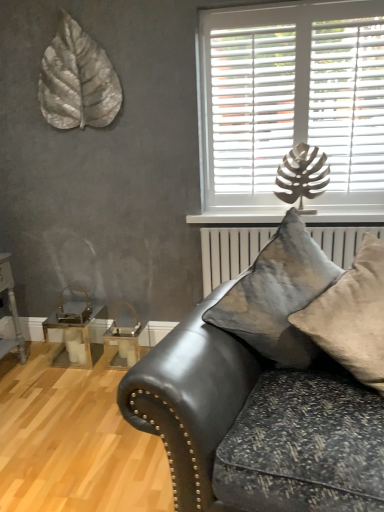
Based on the photo, what is the approximate width of metallic gold table at lower left, placed as the second table when sorted from right to left?

The width of metallic gold table at lower left, placed as the second table when sorted from right to left, is 11.11 inches.

Measure the distance between metallic silver leaf at upper left and camera.

2.38 meters.

Measure the distance between point (208, 380) and camera.

4.64 feet.

This screenshot has height=512, width=384. Describe the element at coordinates (291, 99) in the screenshot. I see `white plastic blinds at upper right` at that location.

You are a GUI agent. You are given a task and a screenshot of the screen. Output one action in this format:
    pyautogui.click(x=<x>, y=<y>)
    Task: Click on the white plastic blinds at upper right
    This screenshot has height=512, width=384.
    Given the screenshot: What is the action you would take?
    pyautogui.click(x=291, y=99)

Find the location of a particular element. This screenshot has height=512, width=384. velvet gray pillow at center, the first pillow positioned from the left is located at coordinates (277, 295).

What is the approximate height of textured beige pillow at center, which appears as the first pillow when viewed from the right?

textured beige pillow at center, which appears as the first pillow when viewed from the right, is 21.19 inches in height.

I want to click on textured beige pillow at center, the second pillow from the left, so click(x=352, y=316).

Where is `clear glass table at lower left, the second table in the left-to-right sequence`? clear glass table at lower left, the second table in the left-to-right sequence is located at coordinates (122, 347).

How different are the orientations of textured beige pillow at center, the second pillow from the left, and velvet gray pillow at center, which is the 2th pillow in right-to-left order, in degrees?

The angular difference between textured beige pillow at center, the second pillow from the left, and velvet gray pillow at center, which is the 2th pillow in right-to-left order, is 0.000203 degrees.

Is point (310, 315) positioned after point (238, 286)?

No, (310, 315) is closer to viewer.

Is textured beige pillow at center, which appears as the first pillow when viewed from the right, wider than velvet gray pillow at center, which is the 2th pillow in right-to-left order?

Indeed, textured beige pillow at center, which appears as the first pillow when viewed from the right, has a greater width compared to velvet gray pillow at center, which is the 2th pillow in right-to-left order.

Which is correct: textured beige pillow at center, which appears as the first pillow when viewed from the right, is inside velvet gray pillow at center, the first pillow positioned from the left, or outside of it?

textured beige pillow at center, which appears as the first pillow when viewed from the right, can be found inside velvet gray pillow at center, the first pillow positioned from the left.

From the image's perspective, would you say leather couch at lower right is shown under white plastic blinds at upper right?

Correct, leather couch at lower right appears lower than white plastic blinds at upper right in the image.

Considering the relative sizes of leather couch at lower right and white plastic blinds at upper right in the image provided, is leather couch at lower right wider than white plastic blinds at upper right?

Yes.

Can you confirm if leather couch at lower right is taller than white plastic blinds at upper right?

Incorrect, the height of leather couch at lower right is not larger of that of white plastic blinds at upper right.

The width and height of the screenshot is (384, 512). In order to click on the 1st table positioned below the velvet gray pillow at center, which is the 2th pillow in right-to-left order (from the image's perspective) in this screenshot , I will do `click(76, 328)`.

From their relative heights in the image, would you say metallic gold table at lower left, which is counted as the first table, starting from the left, is taller or shorter than velvet gray pillow at center, the first pillow positioned from the left?

metallic gold table at lower left, which is counted as the first table, starting from the left, is shorter than velvet gray pillow at center, the first pillow positioned from the left.

Considering the relative sizes of metallic gold table at lower left, placed as the second table when sorted from right to left, and velvet gray pillow at center, which is the 2th pillow in right-to-left order, in the image provided, is metallic gold table at lower left, placed as the second table when sorted from right to left, bigger than velvet gray pillow at center, which is the 2th pillow in right-to-left order,?

Actually, metallic gold table at lower left, placed as the second table when sorted from right to left, might be smaller than velvet gray pillow at center, which is the 2th pillow in right-to-left order.

Which of these two, metallic gold table at lower left, placed as the second table when sorted from right to left, or velvet gray pillow at center, the first pillow positioned from the left, is wider?

Wider between the two is velvet gray pillow at center, the first pillow positioned from the left.

Considering the relative positions of clear glass table at lower left, which appears as the first table when viewed from the right, and velvet gray pillow at center, the first pillow positioned from the left, in the image provided, is clear glass table at lower left, which appears as the first table when viewed from the right, to the left or to the right of velvet gray pillow at center, the first pillow positioned from the left,?

From the image, it's evident that clear glass table at lower left, which appears as the first table when viewed from the right, is to the left of velvet gray pillow at center, the first pillow positioned from the left.

Could you measure the distance between clear glass table at lower left, which appears as the first table when viewed from the right, and velvet gray pillow at center, the first pillow positioned from the left?

clear glass table at lower left, which appears as the first table when viewed from the right, and velvet gray pillow at center, the first pillow positioned from the left, are 1.36 meters apart from each other.

From the image's perspective, is clear glass table at lower left, the second table in the left-to-right sequence, beneath velvet gray pillow at center, which is the 2th pillow in right-to-left order?

Yes, from the image's perspective, clear glass table at lower left, the second table in the left-to-right sequence, is beneath velvet gray pillow at center, which is the 2th pillow in right-to-left order.

Which of these two, clear glass table at lower left, which appears as the first table when viewed from the right, or velvet gray pillow at center, which is the 2th pillow in right-to-left order, is bigger?

velvet gray pillow at center, which is the 2th pillow in right-to-left order, is bigger.

Would you consider textured beige pillow at center, the second pillow from the left, to be distant from metallic gold table at lower left, which is counted as the first table, starting from the left?

Yes, textured beige pillow at center, the second pillow from the left, and metallic gold table at lower left, which is counted as the first table, starting from the left, are located far from each other.

From the image's perspective, which one is positioned higher, textured beige pillow at center, which appears as the first pillow when viewed from the right, or metallic gold table at lower left, which is counted as the first table, starting from the left?

textured beige pillow at center, which appears as the first pillow when viewed from the right, is shown above in the image.

Which of these two, textured beige pillow at center, the second pillow from the left, or metallic gold table at lower left, placed as the second table when sorted from right to left, is thinner?

metallic gold table at lower left, placed as the second table when sorted from right to left.

Which point is more distant from viewer, (353, 335) or (60, 323)?

→ The point (60, 323) is farther.

Consider the image. Is the position of leather couch at lower right more distant than that of clear glass table at lower left, the second table in the left-to-right sequence?

That is False.

Is leather couch at lower right facing towards clear glass table at lower left, which appears as the first table when viewed from the right?

No, leather couch at lower right is not aimed at clear glass table at lower left, which appears as the first table when viewed from the right.

Where is `studio couch that is on the right side of clear glass table at lower left, the second table in the left-to-right sequence`? The height and width of the screenshot is (512, 384). studio couch that is on the right side of clear glass table at lower left, the second table in the left-to-right sequence is located at coordinates (191, 398).

Considering the sizes of objects leather couch at lower right and clear glass table at lower left, which appears as the first table when viewed from the right, in the image provided, who is wider, leather couch at lower right or clear glass table at lower left, which appears as the first table when viewed from the right,?

Result: leather couch at lower right.

From a real-world perspective, which object stands above the other?

In real-world perspective, metallic silver leaf at upper left is above.

Would you say metallic silver leaf at upper left is a long distance from textured beige pillow at center, which appears as the first pillow when viewed from the right?

metallic silver leaf at upper left is positioned a significant distance from textured beige pillow at center, which appears as the first pillow when viewed from the right.

Looking at this image, can you confirm if metallic silver leaf at upper left is wider than textured beige pillow at center, which appears as the first pillow when viewed from the right?

In fact, metallic silver leaf at upper left might be narrower than textured beige pillow at center, which appears as the first pillow when viewed from the right.

Considering the positions of points (52, 111) and (352, 286), is point (52, 111) farther from camera compared to point (352, 286)?

Yes, point (52, 111) is farther from viewer.

Where is `pillow on the left of the textured beige pillow at center, the second pillow from the left`? pillow on the left of the textured beige pillow at center, the second pillow from the left is located at coordinates (277, 295).

Locate an element on the screen. Image resolution: width=384 pixels, height=512 pixels. window that appears behind the leather couch at lower right is located at coordinates click(x=291, y=99).

Looking at the image, which one is located further to white plastic blinds at upper right, velvet gray pillow at center, the first pillow positioned from the left, or textured beige pillow at center, the second pillow from the left?

textured beige pillow at center, the second pillow from the left.

Estimate the real-world distances between objects in this image. Which object is closer to textured beige pillow at center, the second pillow from the left, white plastic blinds at upper right or metallic silver leaf at upper left?

white plastic blinds at upper right is closer to textured beige pillow at center, the second pillow from the left.

Which object lies further to the anchor point leather couch at lower right, metallic silver leaf at upper left or clear glass table at lower left, the second table in the left-to-right sequence?

metallic silver leaf at upper left is further to leather couch at lower right.

When comparing their distances from velvet gray pillow at center, which is the 2th pillow in right-to-left order, does metallic gold table at lower left, which is counted as the first table, starting from the left, or metallic silver leaf at upper left seem further?

Based on the image, metallic silver leaf at upper left appears to be further to velvet gray pillow at center, which is the 2th pillow in right-to-left order.

When comparing their distances from clear glass table at lower left, which appears as the first table when viewed from the right, does metallic silver leaf at upper left or leather couch at lower right seem closer?

The object closer to clear glass table at lower left, which appears as the first table when viewed from the right, is leather couch at lower right.

Based on their spatial positions, is metallic silver leaf at upper left or metallic gold table at lower left, which is counted as the first table, starting from the left, closer to white plastic blinds at upper right?

metallic silver leaf at upper left.

Which object lies further to the anchor point metallic silver leaf at upper left, velvet gray pillow at center, which is the 2th pillow in right-to-left order, or white plastic blinds at upper right?

velvet gray pillow at center, which is the 2th pillow in right-to-left order, is positioned further to the anchor metallic silver leaf at upper left.

Looking at the image, which one is located further to leather couch at lower right, metallic gold table at lower left, placed as the second table when sorted from right to left, or white plastic blinds at upper right?

Based on the image, metallic gold table at lower left, placed as the second table when sorted from right to left, appears to be further to leather couch at lower right.

At what (x,y) coordinates should I click in order to perform the action: click on table between white plastic blinds at upper right and clear glass table at lower left, the second table in the left-to-right sequence, vertically. Please return your answer as a coordinate pair (x, y). The width and height of the screenshot is (384, 512). Looking at the image, I should click on (76, 328).

Locate an element on the screen. The image size is (384, 512). pillow between velvet gray pillow at center, the first pillow positioned from the left, and leather couch at lower right, in the vertical direction is located at coordinates (352, 316).

The image size is (384, 512). I want to click on pillow between metallic silver leaf at upper left and textured beige pillow at center, the second pillow from the left, in the up-down direction, so click(277, 295).

I want to click on table that lies between metallic silver leaf at upper left and clear glass table at lower left, which appears as the first table when viewed from the right, from top to bottom, so click(x=76, y=328).